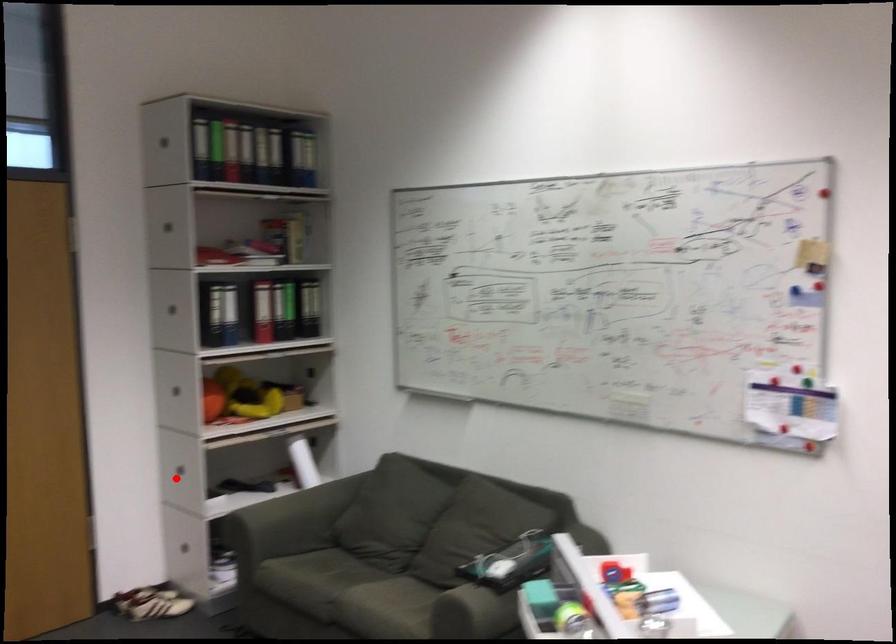
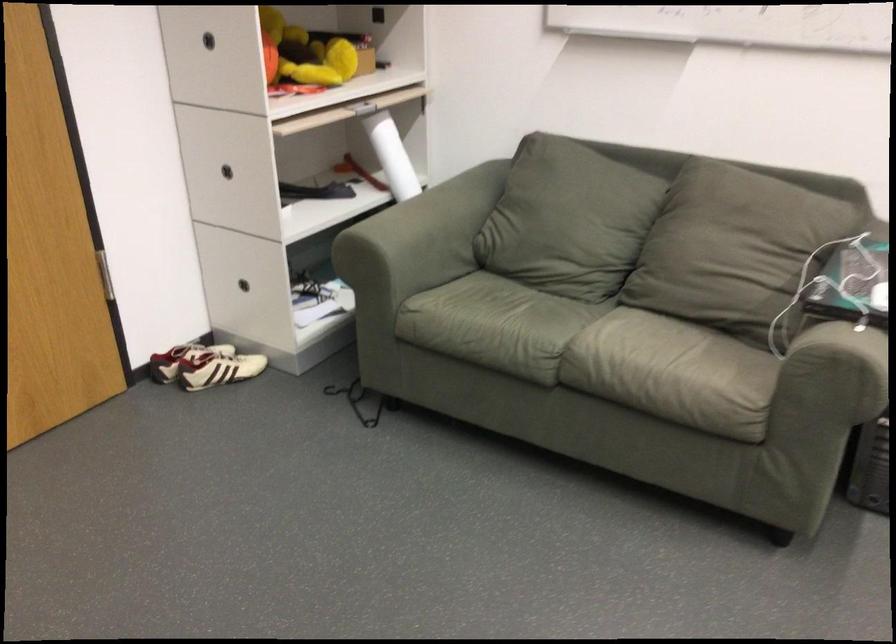
Question: I am providing you with two images of the same scene from different viewpoints. Given a red point in image1, look at the same physical point in image2. Is it:

Choices:
 (A) Closer to the viewpoint
 (B) Farther from the viewpoint

Answer: (A)